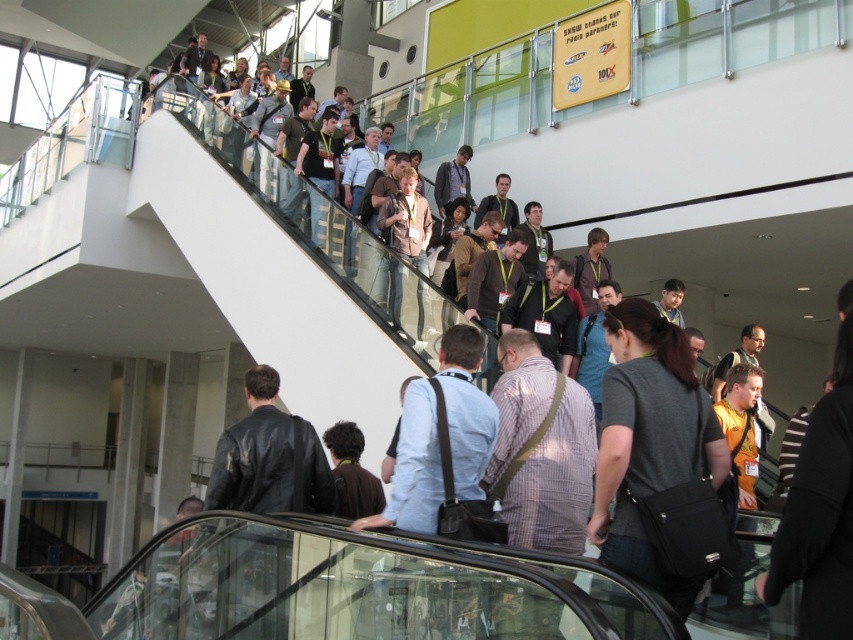
Does dark gray fabric shirt at center come behind leather jacket at center?

No, it is not.

From the picture: Does dark gray fabric shirt at center appear on the right side of leather jacket at center?

Indeed, dark gray fabric shirt at center is positioned on the right side of leather jacket at center.

The image size is (853, 640). What do you see at coordinates (648, 442) in the screenshot?
I see `dark gray fabric shirt at center` at bounding box center [648, 442].

The width and height of the screenshot is (853, 640). Identify the location of dark gray fabric shirt at center. (648, 442).